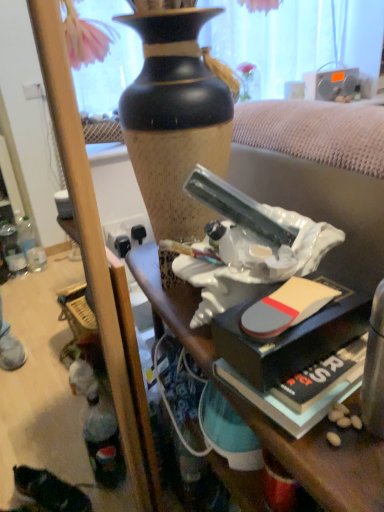
Question: From a real-world perspective, is white glossy statue at center beneath hardcover book at lower right?

Choices:
 (A) no
 (B) yes

Answer: (B)

Question: Can you confirm if white glossy statue at center is bigger than hardcover book at lower right?

Choices:
 (A) no
 (B) yes

Answer: (B)

Question: Considering the relative positions of white glossy statue at center and hardcover book at lower right in the image provided, is white glossy statue at center behind hardcover book at lower right?

Choices:
 (A) yes
 (B) no

Answer: (B)

Question: From the image's perspective, is white glossy statue at center under hardcover book at lower right?

Choices:
 (A) yes
 (B) no

Answer: (A)

Question: Is white glossy statue at center beside hardcover book at lower right?

Choices:
 (A) no
 (B) yes

Answer: (A)

Question: Can you confirm if white glossy statue at center is smaller than hardcover book at lower right?

Choices:
 (A) yes
 (B) no

Answer: (B)

Question: Is hardcover book at lower right smaller than silver metallic radio at upper right?

Choices:
 (A) yes
 (B) no

Answer: (A)

Question: Would you consider hardcover book at lower right to be distant from silver metallic radio at upper right?

Choices:
 (A) yes
 (B) no

Answer: (A)

Question: From a real-world perspective, is hardcover book at lower right positioned under silver metallic radio at upper right based on gravity?

Choices:
 (A) yes
 (B) no

Answer: (A)

Question: Does hardcover book at lower right have a lesser width compared to silver metallic radio at upper right?

Choices:
 (A) no
 (B) yes

Answer: (A)

Question: Is hardcover book at lower right aimed at silver metallic radio at upper right?

Choices:
 (A) yes
 (B) no

Answer: (B)

Question: Is silver metallic radio at upper right inside hardcover book at lower right?

Choices:
 (A) yes
 (B) no

Answer: (B)

Question: Is hardcover book at lower right oriented away from white glossy statue at center?

Choices:
 (A) yes
 (B) no

Answer: (B)